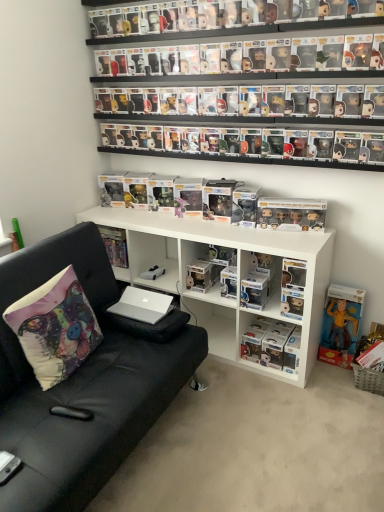
The height and width of the screenshot is (512, 384). What are the coordinates of `hardcover book at center, acting as the 1th book starting from the left` in the screenshot? It's located at (115, 245).

What do you see at coordinates (55, 327) in the screenshot? I see `matte fabric pillow at left` at bounding box center [55, 327].

The width and height of the screenshot is (384, 512). Describe the element at coordinates (142, 305) in the screenshot. I see `silver metallic laptop at center` at that location.

Find the location of a particular element. The image size is (384, 512). matte black figurine at upper center, the 2th toy positioned from the back is located at coordinates (106, 64).

What do you see at coordinates (106, 64) in the screenshot? I see `matte black figurine at upper center, marked as the fourth toy in a right-to-left arrangement` at bounding box center [106, 64].

Describe the element at coordinates (291, 214) in the screenshot. I see `satin gold figurines at center, which is the second toy from bottom to top` at that location.

What do you see at coordinates (218, 281) in the screenshot? I see `white matte shelf at center` at bounding box center [218, 281].

The image size is (384, 512). What do you see at coordinates (341, 325) in the screenshot? I see `yellow fabric figurine at lower right, which is counted as the first book, starting from the right` at bounding box center [341, 325].

Where is `hardcover book at center, acting as the 1th book starting from the left`? hardcover book at center, acting as the 1th book starting from the left is located at coordinates (115, 245).

From the image's perspective, which one is positioned lower, white matte shelf at center or black plastic remote control at lower left?

black plastic remote control at lower left, from the image's perspective.

Is black plastic remote control at lower left a part of white matte shelf at center?

No, black plastic remote control at lower left is not surrounded by white matte shelf at center.

Who is smaller, white matte shelf at center or black plastic remote control at lower left?

black plastic remote control at lower left.

Is matte fabric pillow at left at the back of matte black figurine at upper center, the 3th toy positioned from the bottom?

No, matte black figurine at upper center, the 3th toy positioned from the bottom, is not facing away from matte fabric pillow at left.

Looking at their sizes, would you say matte black figurine at upper center, which appears as the fourth toy when viewed from the left, is wider or thinner than matte fabric pillow at left?

In the image, matte black figurine at upper center, which appears as the fourth toy when viewed from the left, appears to be more narrow than matte fabric pillow at left.

Find the location of a particular element. the 3rd toy above the matte fabric pillow at left (from a real-world perspective) is located at coordinates (379, 8).

Who is taller, matte black figurine at upper center, placed as the first toy when sorted from front to back, or matte fabric pillow at left?

matte fabric pillow at left.

From the image's perspective, does matte black figurine at upper center, placed as the first toy when sorted from front to back, appear lower than satin gold figurines at center, which appears as the 3th toy when viewed from the top?

No, from the image's perspective, matte black figurine at upper center, placed as the first toy when sorted from front to back, is not beneath satin gold figurines at center, which appears as the 3th toy when viewed from the top.

Is matte black figurine at upper center, placed as the first toy when sorted from front to back, next to satin gold figurines at center, which is the second toy from bottom to top, and touching it?

No, matte black figurine at upper center, placed as the first toy when sorted from front to back, is not next to satin gold figurines at center, which is the second toy from bottom to top.

From a real-world perspective, which toy is the 2nd one above the satin gold figurines at center, the 3th toy viewed from the left? Please provide its 2D coordinates.

[(379, 8)]

Which of these two, matte black figurine at upper center, placed as the first toy when sorted from front to back, or satin gold figurines at center, the 3th toy viewed from the left, is smaller?

Smaller between the two is matte black figurine at upper center, placed as the first toy when sorted from front to back.

Would you say matte black figurine at upper center, which appears as the fourth toy when viewed from the left, is to the left or to the right of black leather couch at left in the picture?

matte black figurine at upper center, which appears as the fourth toy when viewed from the left, is to the right of black leather couch at left.

Is matte black figurine at upper center, acting as the 4th toy starting from the back, thinner than black leather couch at left?

Indeed, matte black figurine at upper center, acting as the 4th toy starting from the back, has a lesser width compared to black leather couch at left.

Which object is more forward, matte black figurine at upper center, acting as the 4th toy starting from the back, or black leather couch at left?

black leather couch at left is more forward.

Is the surface of matte black figurine at upper center, which appears as the fourth toy when viewed from the left, in direct contact with black leather couch at left?

No.

Between clear plastic figure at center, the 2th book viewed from the left, and matte black figurine at upper center, which ranks as the first toy in top-to-bottom order, which one has larger width?

clear plastic figure at center, the 2th book viewed from the left, is wider.

Does clear plastic figure at center, the 2th book viewed from the left, turn towards matte black figurine at upper center, the third toy when ordered from front to back?

No, clear plastic figure at center, the 2th book viewed from the left, is not aimed at matte black figurine at upper center, the third toy when ordered from front to back.

Is satin gold figurines at center, which appears as the 3th toy when viewed from the top, to the left of matte black figurine at upper center, which appears as the fourth toy when viewed from the left, from the viewer's perspective?

Yes.

Is satin gold figurines at center, the third toy from the back, bigger than matte black figurine at upper center, placed as the first toy when sorted from front to back?

Correct, satin gold figurines at center, the third toy from the back, is larger in size than matte black figurine at upper center, placed as the first toy when sorted from front to back.

Does satin gold figurines at center, which appears as the 3th toy when viewed from the top, have a lesser width compared to matte black figurine at upper center, the 1th toy in the right-to-left sequence?

In fact, satin gold figurines at center, which appears as the 3th toy when viewed from the top, might be wider than matte black figurine at upper center, the 1th toy in the right-to-left sequence.

From a real-world perspective, which is physically below, satin gold figurines at center, the 3th toy viewed from the left, or matte black figurine at upper center, the 1th toy in the right-to-left sequence?

satin gold figurines at center, the 3th toy viewed from the left, is physically lower.

Looking at this image, would you say clear plastic figure at center, the 2th book viewed from the left, contains white matte car at center, which appears as the 4th toy when viewed from the top?

Actually, white matte car at center, which appears as the 4th toy when viewed from the top, is outside clear plastic figure at center, the 2th book viewed from the left.

From the picture: From a real-world perspective, is clear plastic figure at center, the 2th book viewed from the left, on white matte car at center, which is the first toy in back-to-front order?

No, from a real-world perspective, clear plastic figure at center, the 2th book viewed from the left, is not over white matte car at center, which is the first toy in back-to-front order

Does clear plastic figure at center, marked as the second book in a right-to-left arrangement, have a greater width compared to white matte car at center, placed as the second toy when sorted from left to right?

Yes, clear plastic figure at center, marked as the second book in a right-to-left arrangement, is wider than white matte car at center, placed as the second toy when sorted from left to right.

In terms of size, does clear plastic figure at center, the 2th book viewed from the left, appear bigger or smaller than white matte car at center, acting as the first toy starting from the bottom?

In the image, clear plastic figure at center, the 2th book viewed from the left, appears to be larger than white matte car at center, acting as the first toy starting from the bottom.

Identify the location of remote control located on the left of white matte shelf at center. The width and height of the screenshot is (384, 512). (72, 412).

Where is `pillow in front of the matte black figurine at upper center, placed as the first toy when sorted from front to back`? pillow in front of the matte black figurine at upper center, placed as the first toy when sorted from front to back is located at coordinates (55, 327).

When comparing their distances from white matte car at center, which is counted as the fourth toy, starting from the front, does matte fabric pillow at left or silver metallic laptop at center seem closer?

silver metallic laptop at center is positioned closer to the anchor white matte car at center, which is counted as the fourth toy, starting from the front.

When comparing their distances from black plastic remote control at lower left, does yellow fabric figurine at lower right, the third book positioned from the left, or matte fabric pillow at left seem closer?

Among the two, matte fabric pillow at left is located nearer to black plastic remote control at lower left.

When comparing their distances from white matte car at center, acting as the first toy starting from the bottom, does satin gold figurines at center, the 3th toy viewed from the left, or silver metallic laptop at center seem closer?

silver metallic laptop at center.

Considering their positions, is silver metallic laptop at center positioned further to black plastic remote control at lower left than matte black figurine at upper center, acting as the 4th toy starting from the back?

matte black figurine at upper center, acting as the 4th toy starting from the back.

Based on their spatial positions, is matte fabric pillow at left or black plastic remote control at lower left closer to black leather couch at left?

Based on the image, matte fabric pillow at left appears to be nearer to black leather couch at left.

Looking at the image, which one is located further to clear plastic figure at center, marked as the second book in a right-to-left arrangement, white matte car at center, which is counted as the fourth toy, starting from the front, or black plastic remote control at lower left?

black plastic remote control at lower left.

Looking at the image, which one is located further to black plastic remote control at lower left, matte black figurine at upper center, the third toy when ordered from front to back, or black leather couch at left?

matte black figurine at upper center, the third toy when ordered from front to back, lies further to black plastic remote control at lower left than the other object.

Considering their positions, is hardcover book at center, the third book viewed from the right, positioned further to satin gold figurines at center, the 3th toy viewed from the left, than clear plastic figure at center, the 2th book viewed from the left?

hardcover book at center, the third book viewed from the right.

This screenshot has height=512, width=384. I want to click on studio couch between matte black figurine at upper center, which appears as the fourth toy when viewed from the left, and clear plastic figure at center, the 2th book viewed from the left, in the vertical direction, so click(84, 381).

Identify the location of shelf located between silver metallic laptop at center and satin gold figurines at center, which appears as the 3th toy when viewed from the top, in the left-right direction. The height and width of the screenshot is (512, 384). (x=218, y=281).

Where is `shelf between matte fabric pillow at left and satin gold figurines at center, the second toy from the right, from left to right`? This screenshot has width=384, height=512. shelf between matte fabric pillow at left and satin gold figurines at center, the second toy from the right, from left to right is located at coordinates (218, 281).

Find the location of `studio couch located between matte fabric pillow at left and clear plastic figure at center, the 2th book viewed from the left, in the left-right direction`. studio couch located between matte fabric pillow at left and clear plastic figure at center, the 2th book viewed from the left, in the left-right direction is located at coordinates (84, 381).